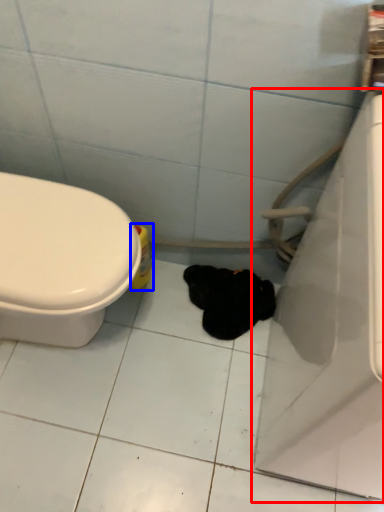
Question: Which object is closer to the camera taking this photo, bath (highlighted by a red box) or cleaning product (highlighted by a blue box)?

Choices:
 (A) bath
 (B) cleaning product

Answer: (A)